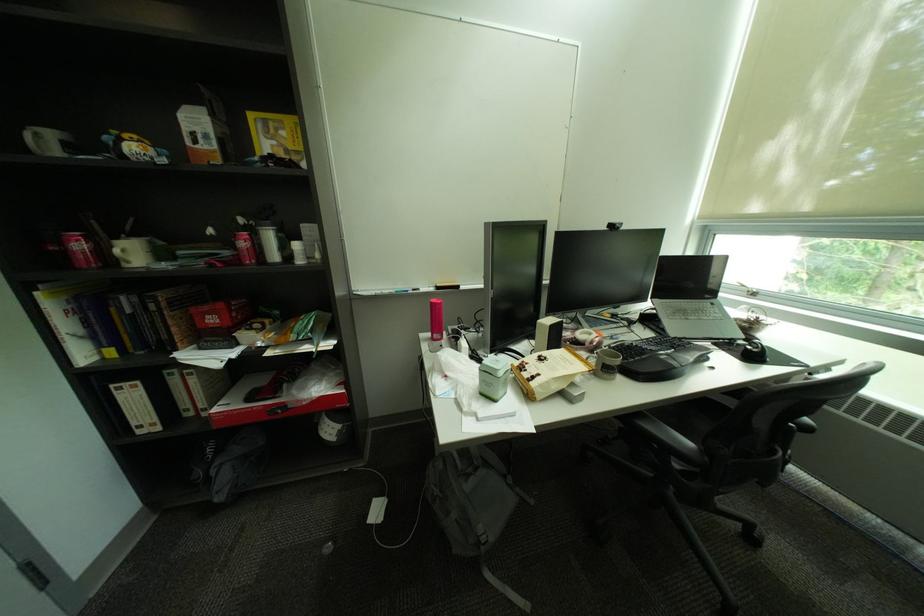
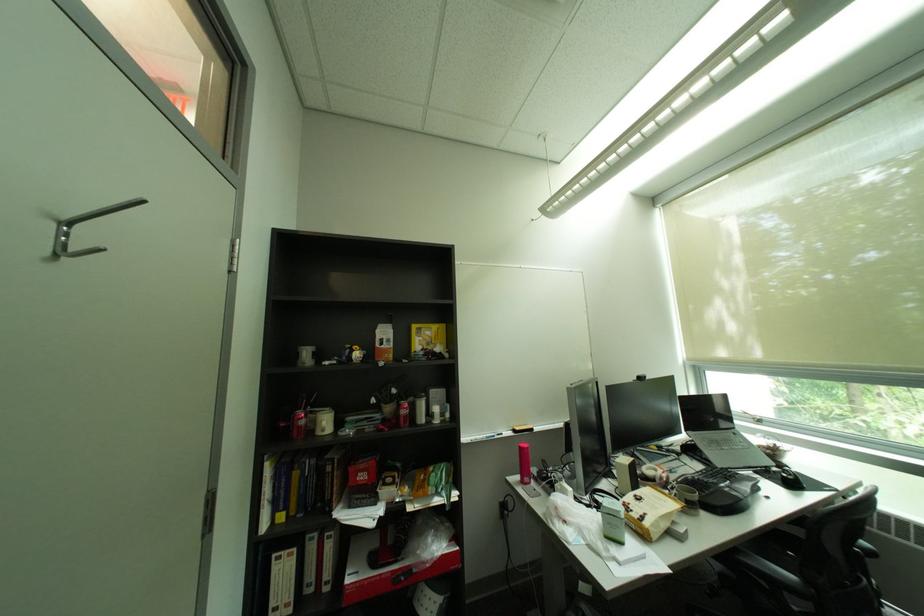
Locate, in the second image, the point that corresponds to pixel 684 458 in the first image.

(796, 594)